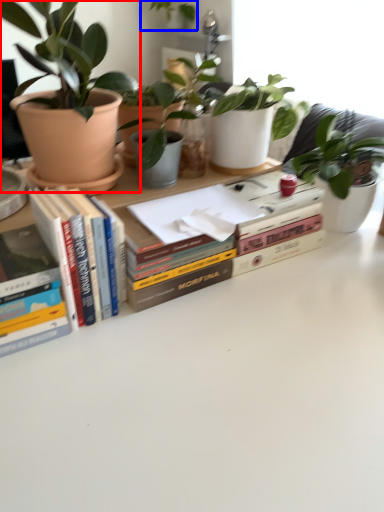
Question: Which object appears farthest to the camera in this image, houseplant (highlighted by a red box) or houseplant (highlighted by a blue box)?

Choices:
 (A) houseplant
 (B) houseplant

Answer: (B)